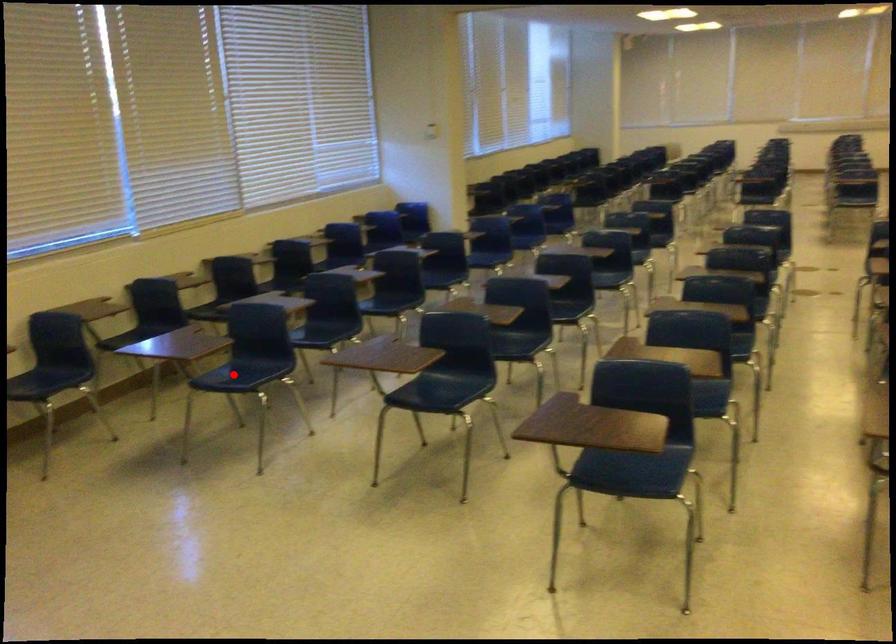
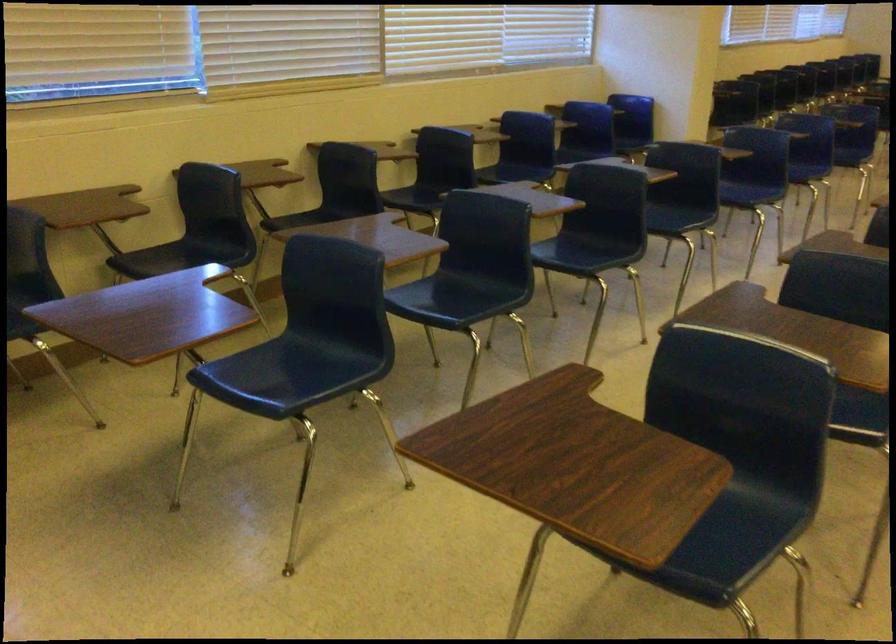
Question: I am providing you with two images of the same scene from different viewpoints. Given a red point in image1, look at the same physical point in image2. Is it:

Choices:
 (A) Closer to the viewpoint
 (B) Farther from the viewpoint

Answer: (A)